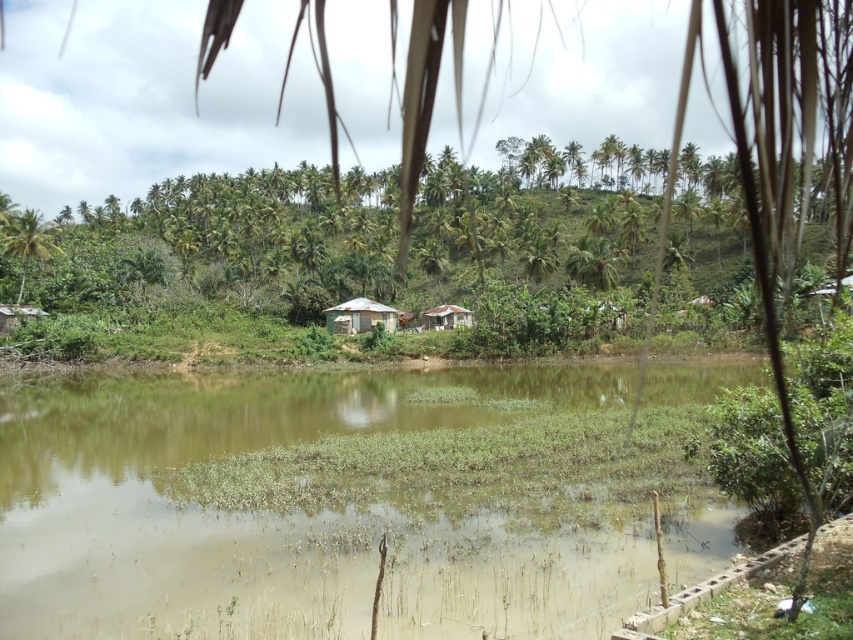
Question: Which object is positioned closest to the green leafy palm tree at left?

Choices:
 (A) rusty corrugated metal hut at center
 (B) green corrugated metal hut at center

Answer: (B)

Question: Observing the image, what is the correct spatial positioning of green corrugated metal hut at center in reference to rusty corrugated metal hut at center?

Choices:
 (A) above
 (B) below

Answer: (B)

Question: Estimate the real-world distances between objects in this image. Which object is closer to the brown muddy water at center?

Choices:
 (A) green corrugated metal hut at center
 (B) rusty corrugated metal hut at center
 (C) green leafy palm tree at left

Answer: (A)

Question: Among these objects, which one is nearest to the camera?

Choices:
 (A) brown muddy water at center
 (B) green corrugated metal hut at center
 (C) rusty corrugated metal hut at center

Answer: (A)

Question: Does green leafy palm tree at left appear on the left side of green corrugated metal hut at center?

Choices:
 (A) no
 (B) yes

Answer: (B)

Question: Is the position of brown muddy water at center more distant than that of rusty corrugated metal hut at center?

Choices:
 (A) no
 (B) yes

Answer: (A)